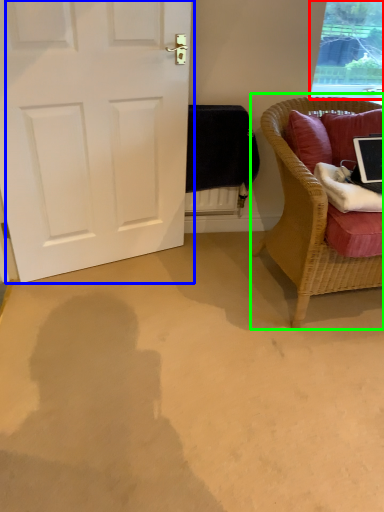
Question: Estimate the real-world distances between objects in this image. Which object is closer to window (highlighted by a red box), door (highlighted by a blue box) or chair (highlighted by a green box)?

Choices:
 (A) door
 (B) chair

Answer: (B)